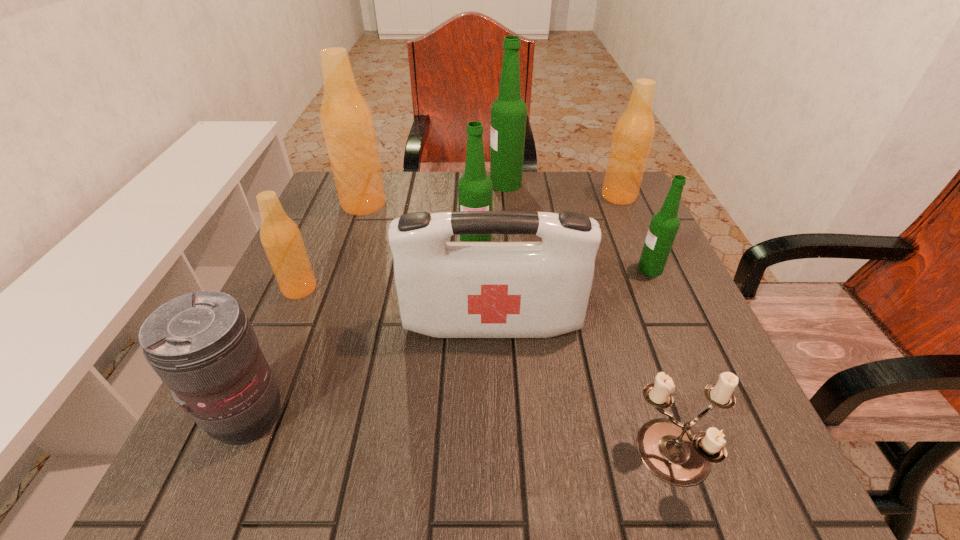
At what (x,y) coordinates should I click in order to perform the action: click on green beer bottle object that ranks as the third closest to the seventh farthest object. Please return your answer as a coordinate pair (x, y). The width and height of the screenshot is (960, 540). Looking at the image, I should click on (508, 112).

Locate which green beer bottle ranks second in proximity to the nearest green beer bottle. Please provide its 2D coordinates. Your answer should be formatted as a tuple, i.e. [(x, y)], where the tuple contains the x and y coordinates of a point satisfying the conditions above.

[(508, 112)]

Identify which tan beer bottle is the nearest to the second smallest tan beer bottle. Please provide its 2D coordinates. Your answer should be formatted as a tuple, i.e. [(x, y)], where the tuple contains the x and y coordinates of a point satisfying the conditions above.

[(347, 123)]

Locate which tan beer bottle is the second closest to the third nearest object. Please provide its 2D coordinates. Your answer should be formatted as a tuple, i.e. [(x, y)], where the tuple contains the x and y coordinates of a point satisfying the conditions above.

[(347, 123)]

At what (x,y) coordinates should I click in order to perform the action: click on vacant space that satisfies the following two spatial constraints: 1. on the label of the second biggest tan beer bottle; 2. on the right side of the farthest green beer bottle. Please return your answer as a coordinate pair (x, y). Looking at the image, I should click on (507, 196).

This screenshot has height=540, width=960. What are the coordinates of `vacant area in the image that satisfies the following two spatial constraints: 1. on the label of the biggest green beer bottle; 2. on the left side of the shortest object` in the screenshot? It's located at (529, 456).

The height and width of the screenshot is (540, 960). What are the coordinates of `vacant space that satisfies the following two spatial constraints: 1. on the label of the leftmost green beer bottle; 2. on the side of the telephoto lens where the control switches are located` in the screenshot? It's located at (474, 416).